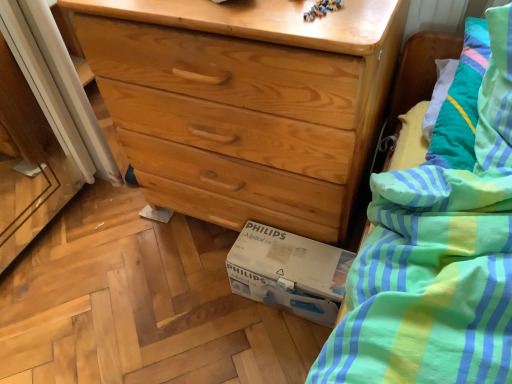
What are the coordinates of `vacant space in front of natural wood chest of drawers at center` in the screenshot? It's located at (204, 326).